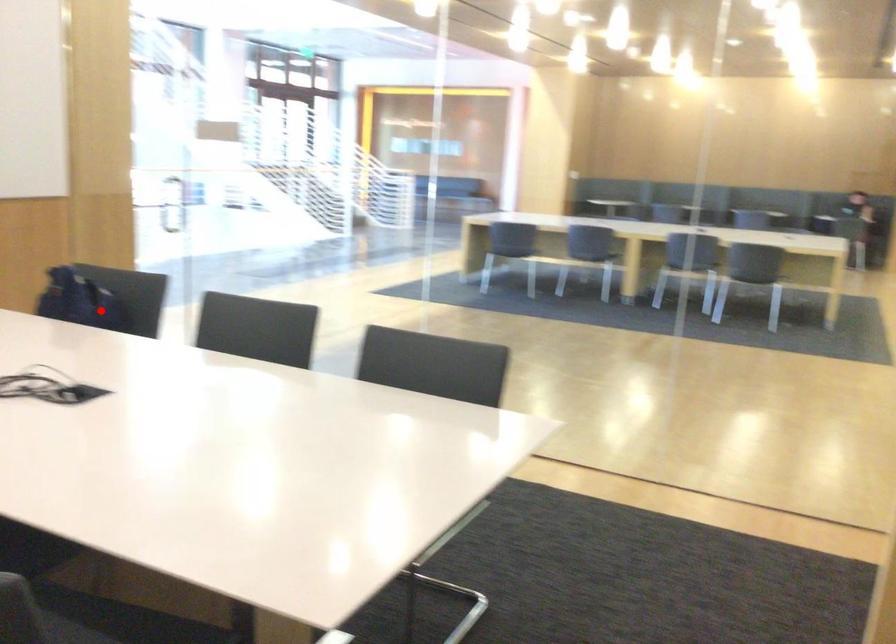
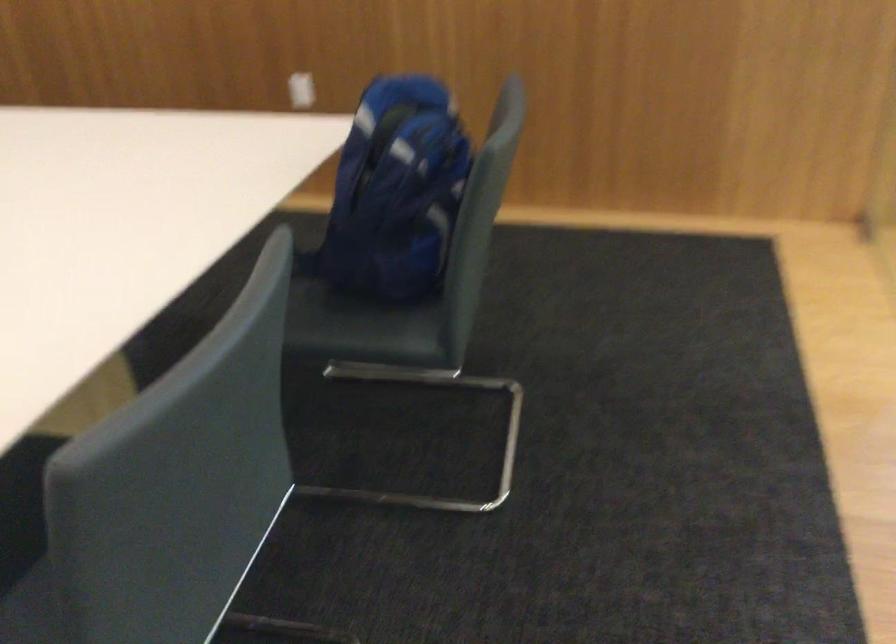
Question: I am providing you with two images of the same scene from different viewpoints. In image1, a red point is highlighted. Considering the same 3D point in image2, which of the following is correct?

Choices:
 (A) It is closer
 (B) It is farther

Answer: (A)